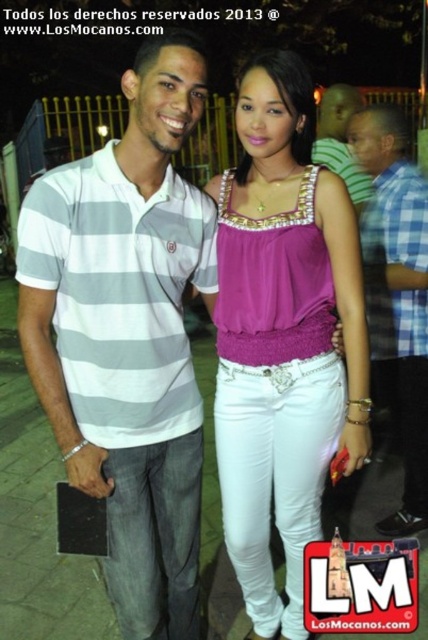
Is gray striped shirt at center bigger than matte gray striped polo shirt at center?

Correct, gray striped shirt at center is larger in size than matte gray striped polo shirt at center.

Where is `gray striped shirt at center`? gray striped shirt at center is located at coordinates tap(397, 296).

Where is `gray striped shirt at center`? gray striped shirt at center is located at coordinates (397, 296).

What do you see at coordinates (282, 337) in the screenshot? Image resolution: width=428 pixels, height=640 pixels. I see `purple beaded tank top at center` at bounding box center [282, 337].

Does purple beaded tank top at center have a smaller size compared to matte gray striped polo shirt at center?

No.

Describe the element at coordinates (282, 337) in the screenshot. I see `purple beaded tank top at center` at that location.

Image resolution: width=428 pixels, height=640 pixels. In order to click on purple beaded tank top at center in this screenshot , I will do `click(282, 337)`.

Can you confirm if gray striped polo shirt at left is bigger than matte gray striped polo shirt at center?

Indeed, gray striped polo shirt at left has a larger size compared to matte gray striped polo shirt at center.

Does gray striped polo shirt at left appear under matte gray striped polo shirt at center?

Correct, gray striped polo shirt at left is located below matte gray striped polo shirt at center.

Is point (128, 179) less distant than point (344, 131)?

That is True.

The image size is (428, 640). Identify the location of gray striped polo shirt at left. (127, 333).